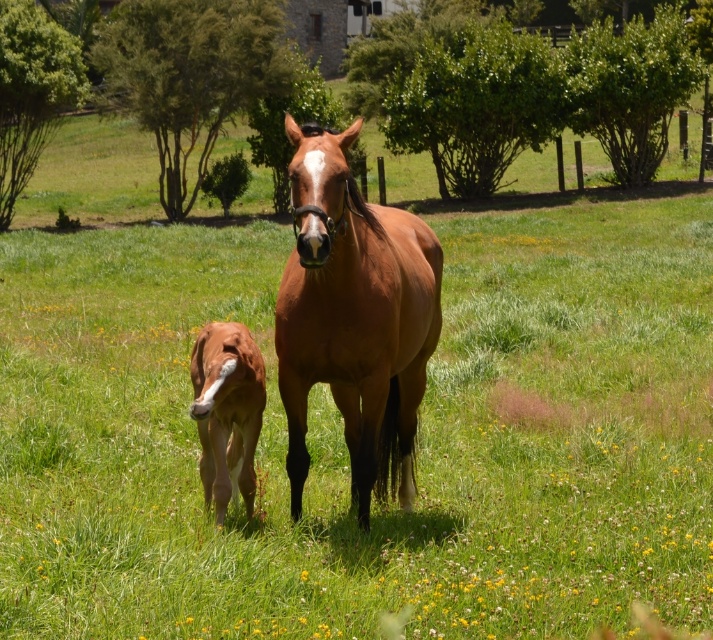
You are a photographer wanting to capture both the brown glossy horse at center and the brown glossy pony at center in a single frame. Based on their positions, which one should you adjust your camera to focus on first to ensure both are in the shot?

The brown glossy horse at center is positioned on the right side of brown glossy pony at center, so you should focus on the brown glossy pony at center first to ensure both are within the frame.

You are a farmer who wants to build a fence around the area where both the brown glossy horse at center and the brown glossy pony at center are grazing. Which animal will require a larger enclosure due to its size?

The brown glossy horse at center is larger in size than the brown glossy pony at center, so it will require a larger enclosure.